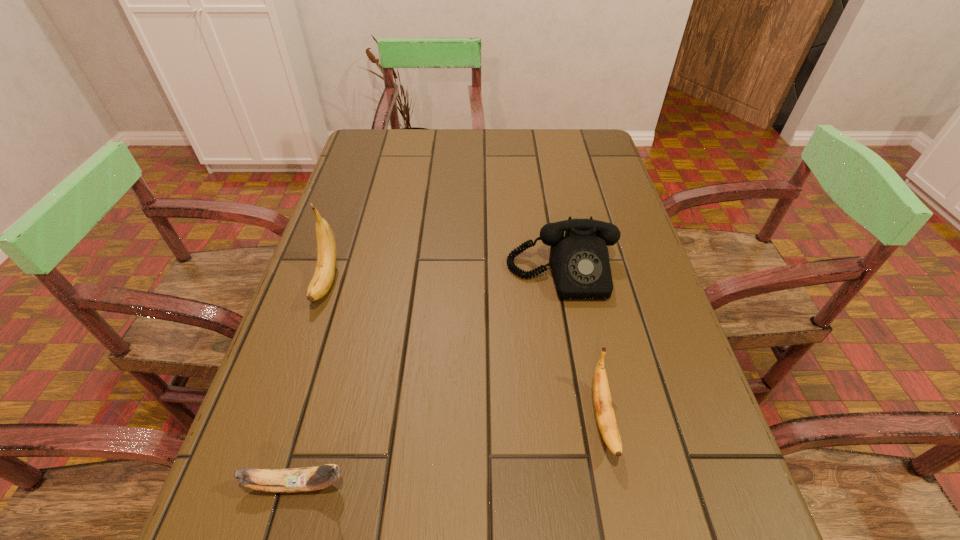
Find the location of a particular element. The image size is (960, 540). the tallest banana is located at coordinates (322, 280).

You are a GUI agent. You are given a task and a screenshot of the screen. Output one action in this format:
    pyautogui.click(x=<x>, y=<y>)
    Task: Click on the tallest object
    The image size is (960, 540).
    Given the screenshot: What is the action you would take?
    pyautogui.click(x=322, y=280)

What are the coordinates of `telephone` in the screenshot? It's located at (579, 261).

You are a GUI agent. You are given a task and a screenshot of the screen. Output one action in this format:
    pyautogui.click(x=<x>, y=<y>)
    Task: Click on the second nearest banana
    
    Given the screenshot: What is the action you would take?
    pyautogui.click(x=604, y=411)

I want to click on the third farthest object, so click(x=604, y=411).

Where is `the nearest banana`? Image resolution: width=960 pixels, height=540 pixels. the nearest banana is located at coordinates (318, 477).

Locate an element on the screen. This screenshot has width=960, height=540. vacant point located 0.200m at the start of the peel on the tallest object is located at coordinates (288, 400).

Find the location of a particular element. This screenshot has width=960, height=540. vacant space located 0.280m on the dial of the second tallest object is located at coordinates (590, 427).

Image resolution: width=960 pixels, height=540 pixels. Find the location of `blank space located 0.090m on the peel of the third farthest object from the top`. blank space located 0.090m on the peel of the third farthest object from the top is located at coordinates (626, 531).

Identify the location of vacant space located at the stem of the nearest banana. (382, 484).